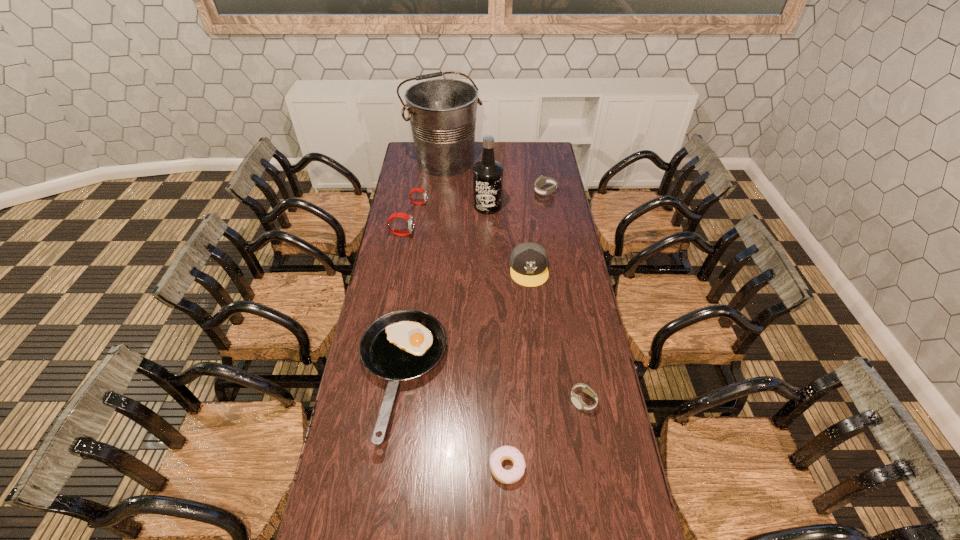
Locate an element on the screen. bucket is located at coordinates (414, 539).

The image size is (960, 540). I want to click on black liquor, so click(414, 539).

The width and height of the screenshot is (960, 540). Identify the location of the third farthest watch. (414, 539).

Identify the location of the fifth farthest object. (414, 539).

Identify the location of cap. (414, 539).

This screenshot has height=540, width=960. I want to click on the sixth farthest object, so click(414, 539).

Locate an element on the screen. The width and height of the screenshot is (960, 540). the farther red watch is located at coordinates (414, 539).

I want to click on the second farthest watch, so click(x=414, y=539).

This screenshot has width=960, height=540. In order to click on the farthest watch in this screenshot , I will do `click(414, 539)`.

At what (x,y) coordinates should I click in order to perform the action: click on the farther white watch. Please return your answer as a coordinate pair (x, y). The width and height of the screenshot is (960, 540). Looking at the image, I should click on (414, 539).